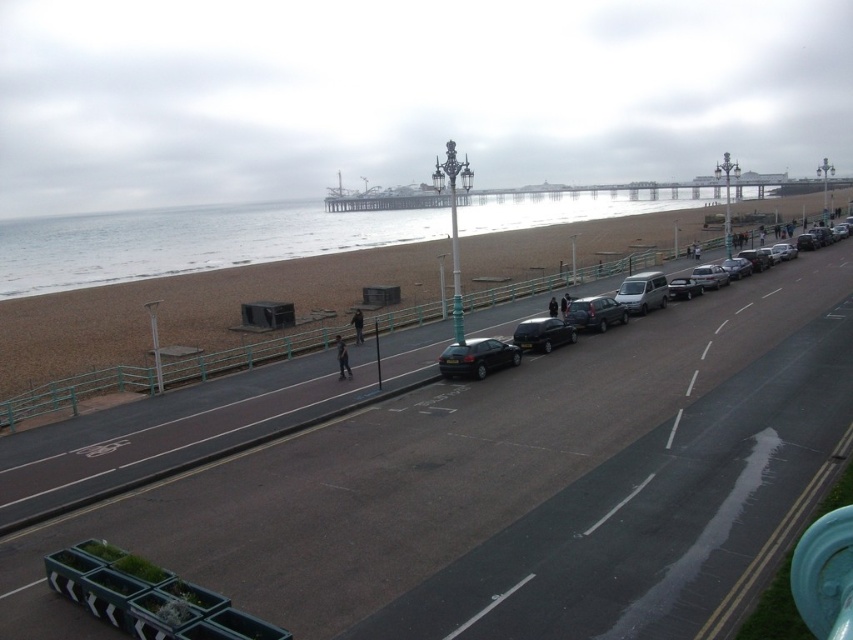
You are a pedestrian standing at the edge of the brown sand at lower left and want to cross to the satin silver van at center. Is there a clear path between them?

The brown sand at lower left is positioned over the satin silver van at center, meaning the sand is covering the van. Therefore, there is no clear path between them as the sand is directly above the van.

Consider the image. You are a delivery person who needs to park your 2.5 meter wide van between the shiny black sedan at center and the satin black sedan at center. Can you fit your van between them?

The shiny black sedan at center and the satin black sedan at center are 3.30 meters apart from each other. Since your van is 2.5 meters wide, it can fit between them as the space is wider than the van.